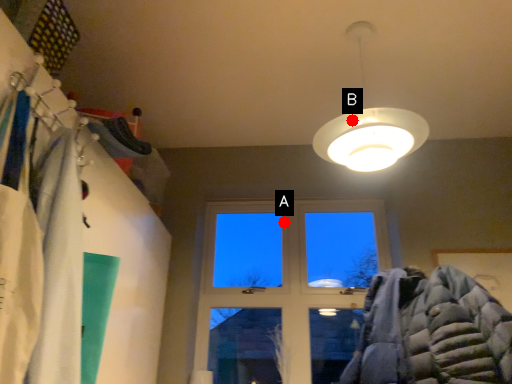
Question: Two points are circled on the image, labeled by A and B beside each circle. Which point is closer to the camera?

Choices:
 (A) A is closer
 (B) B is closer

Answer: (B)